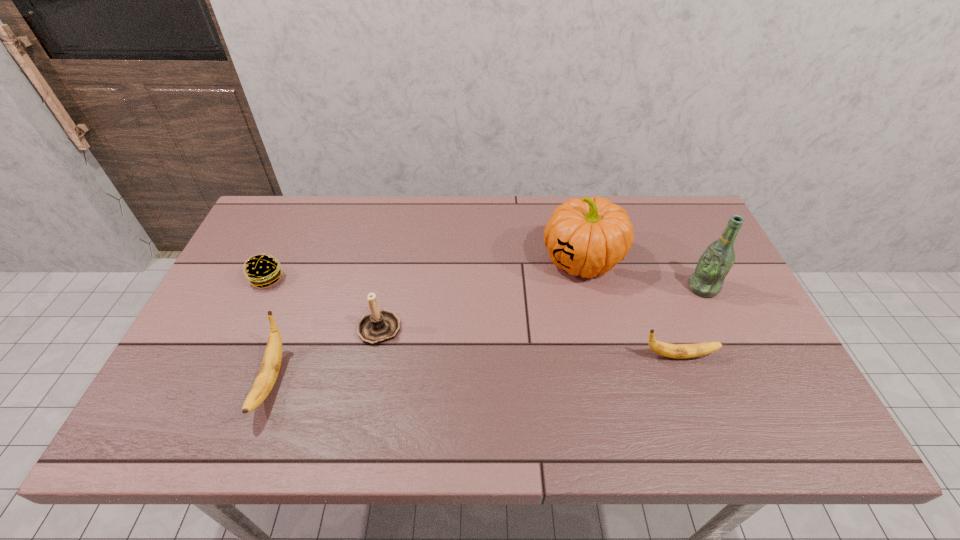
The width and height of the screenshot is (960, 540). I want to click on free region located on the surface of the pumpkin, so click(x=514, y=260).

At what (x,y) coordinates should I click in order to perform the action: click on vacant space located 0.150m on the surface of the pumpkin. Please return your answer as a coordinate pair (x, y). Looking at the image, I should click on (491, 260).

Where is `vacant space located on the surface of the pumpkin`? This screenshot has height=540, width=960. vacant space located on the surface of the pumpkin is located at coordinates click(454, 260).

Find the location of a particular element. blank area located on the surface of the rightmost object is located at coordinates (666, 288).

Where is `free space located 0.400m on the surface of the rightmost object`? free space located 0.400m on the surface of the rightmost object is located at coordinates (546, 288).

Find the location of a particular element. The width and height of the screenshot is (960, 540). free space located on the surface of the rightmost object is located at coordinates (635, 288).

Where is `free spot located 0.380m on the left of the candle holder`? free spot located 0.380m on the left of the candle holder is located at coordinates (212, 327).

Identify the location of vacant point located on the front of the shortest object. (237, 344).

Locate an element on the screen. object positioned at the far edge is located at coordinates (588, 236).

At what (x,y) coordinates should I click in order to perform the action: click on object located at the near edge. Please return your answer as a coordinate pair (x, y). Looking at the image, I should click on (266, 378).